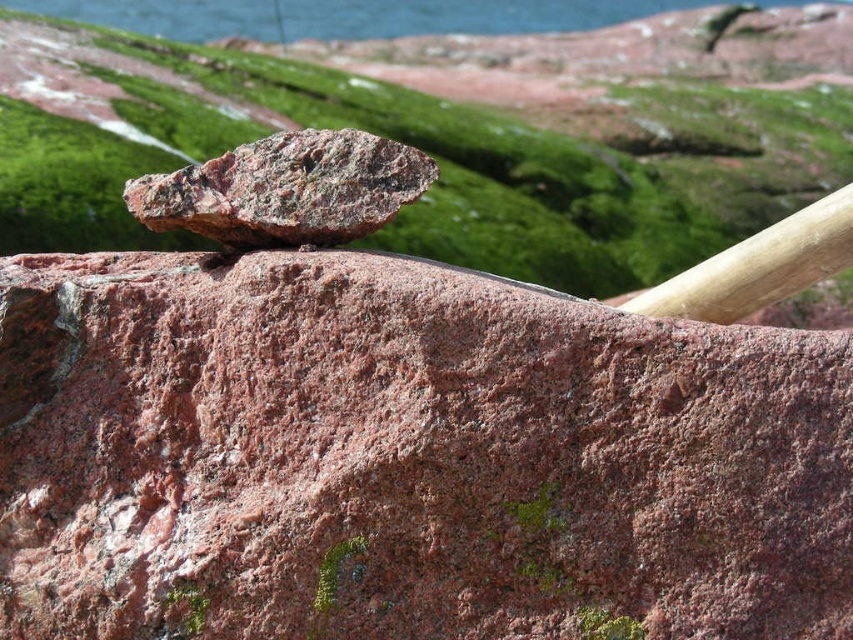
You are standing in front of the scene and want to take a photo of the rusty metallic rock at center and the blue water at upper center. Which object will appear larger in your photo?

The rusty metallic rock at center will appear larger in the photo because it is closer to the viewer than the blue water at upper center.

You are standing in the outdoor scene and want to reach the blue water at upper center without disturbing the rusty granite rock at center. Which direction should you move relative to the rock?

The rusty granite rock at center is located below the blue water at upper center, so to reach the blue water at upper center without disturbing the rock, you should move upward or towards the upper part of the scene relative to the rusty granite rock at center.